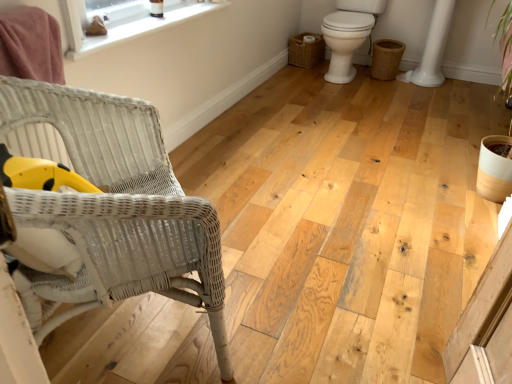
Question: Looking at their shapes, would you say white wicker chair at left is wider or thinner than braided wicker basket at lower right, the second basket when ordered from left to right?

Choices:
 (A) thin
 (B) wide

Answer: (B)

Question: From a real-world perspective, is white wicker chair at left above or below braided wicker basket at lower right, positioned as the 1th basket in right-to-left order?

Choices:
 (A) below
 (B) above

Answer: (B)

Question: Estimate the real-world distances between objects in this image. Which object is closer to the braided wicker basket at lower right, the second basket when ordered from left to right?

Choices:
 (A) woven brown basket at right, the second basket viewed from the right
 (B) white wicker chair at left
 (C) white smooth window sill at upper left
 (D) white glossy toilet at right

Answer: (D)

Question: Considering the real-world distances, which object is farthest from the white wicker chair at left?

Choices:
 (A) woven brown basket at right, the first basket when ordered from left to right
 (B) white smooth window sill at upper left
 (C) white glossy toilet at right
 (D) braided wicker basket at lower right, positioned as the 1th basket in right-to-left order

Answer: (A)